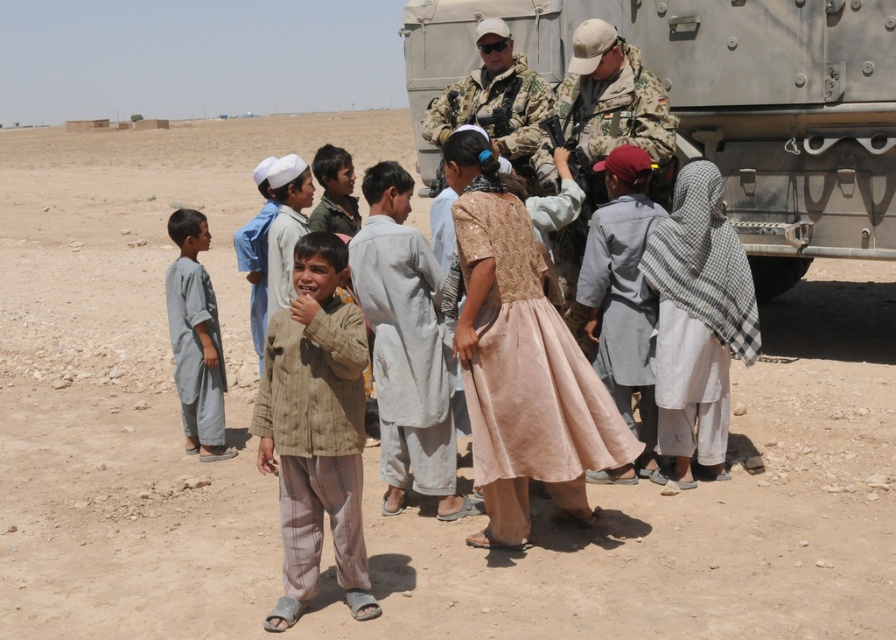
Question: Which of these objects is positioned farthest from the camouflage uniform at center?

Choices:
 (A) gray cotton robe at left
 (B) beige fabric shirt at center
 (C) gray metallic tank at center

Answer: (B)

Question: Which object is the farthest from the gray cotton robe at left?

Choices:
 (A) camouflage uniform at center
 (B) beige fabric shirt at center
 (C) gray metallic tank at center

Answer: (C)

Question: Does gray metallic tank at center have a greater width compared to gray cotton robe at left?

Choices:
 (A) no
 (B) yes

Answer: (B)

Question: Does beige fabric shirt at center appear over camouflage uniform at center?

Choices:
 (A) no
 (B) yes

Answer: (A)

Question: Is beige fabric shirt at center above camouflage uniform at center?

Choices:
 (A) no
 (B) yes

Answer: (A)

Question: Which point appears farthest from the camera in this image?

Choices:
 (A) (472, 77)
 (B) (300, 572)
 (C) (888, 28)

Answer: (A)